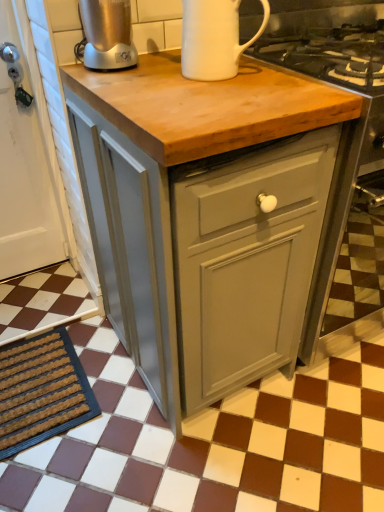
Describe the element at coordinates (214, 38) in the screenshot. This screenshot has height=512, width=384. I see `white ceramic mug at upper center, the first kitchen appliance from the right` at that location.

What do you see at coordinates (214, 443) in the screenshot?
I see `brown checkered tile at center` at bounding box center [214, 443].

In order to click on brown checkered tile at center in this screenshot , I will do `click(214, 443)`.

The width and height of the screenshot is (384, 512). In order to click on matte gray cabinet at center in this screenshot , I will do `click(246, 259)`.

What do you see at coordinates (106, 35) in the screenshot?
I see `brushed metal blender at upper left, which is the 1th kitchen appliance from left to right` at bounding box center [106, 35].

Where is `white ceramic mug at upper center, the 2th kitchen appliance when ordered from left to right`? white ceramic mug at upper center, the 2th kitchen appliance when ordered from left to right is located at coordinates (214, 38).

From a real-world perspective, is brown checkered tile at center positioned above or below brown textured mat at lower left?

brown checkered tile at center is below brown textured mat at lower left.

Could you tell me if brown checkered tile at center is facing brown textured mat at lower left?

No.

Between point (248, 461) and point (70, 346), which one is positioned behind?

Positioned behind is point (70, 346).

From the image's perspective, which is below, brown textured mat at lower left or matte gray cabinet at center?

brown textured mat at lower left, from the image's perspective.

In the image, is brown textured mat at lower left positioned in front of or behind matte gray cabinet at center?

brown textured mat at lower left is behind matte gray cabinet at center.

Image resolution: width=384 pixels, height=512 pixels. Find the location of `doormat behind the matte gray cabinet at center`. doormat behind the matte gray cabinet at center is located at coordinates (41, 391).

Does point (25, 400) come in front of point (174, 179)?

No.

Which is behind, white ceramic mug at upper center, the 2th kitchen appliance when ordered from left to right, or brown checkered tile at center?

white ceramic mug at upper center, the 2th kitchen appliance when ordered from left to right, is more distant.

Which is more to the right, white ceramic mug at upper center, the 2th kitchen appliance when ordered from left to right, or brown checkered tile at center?

From the viewer's perspective, brown checkered tile at center appears more on the right side.

Is matte gray cabinet at center positioned far away from brushed metal blender at upper left, the second kitchen appliance from the right?

matte gray cabinet at center is near brushed metal blender at upper left, the second kitchen appliance from the right, not far away.

From a real-world perspective, starting from the matte gray cabinet at center, which kitchen appliance is the 2nd one vertically above it? Please provide its 2D coordinates.

[(106, 35)]

Which is behind, point (277, 258) or point (99, 46)?

The point (277, 258) is more distant.

Which object is closer to the camera, matte gray cabinet at center or brushed metal blender at upper left, which is the 1th kitchen appliance from left to right?

matte gray cabinet at center.

From a real-world perspective, between matte gray cabinet at center and matte gray cabinet at center, who is vertically higher?

matte gray cabinet at center.

Which object is wider, matte gray cabinet at center or matte gray cabinet at center?

With larger width is matte gray cabinet at center.

Which is nearer, (267,228) or (116,230)?

Point (267,228).

Considering the relative positions of matte gray cabinet at center and matte gray cabinet at center in the image provided, is matte gray cabinet at center to the left of matte gray cabinet at center from the viewer's perspective?

In fact, matte gray cabinet at center is to the right of matte gray cabinet at center.

From the image's perspective, which object appears higher, brushed metal blender at upper left, the second kitchen appliance from the right, or matte gray cabinet at center?

brushed metal blender at upper left, the second kitchen appliance from the right, appears higher in the image.

Looking at the image, does brushed metal blender at upper left, the second kitchen appliance from the right, seem bigger or smaller compared to matte gray cabinet at center?

brushed metal blender at upper left, the second kitchen appliance from the right, is smaller than matte gray cabinet at center.

The height and width of the screenshot is (512, 384). I want to click on the 2nd kitchen appliance above when counting from the matte gray cabinet at center (from the image's perspective), so [106, 35].

Who is smaller, matte gray cabinet at center or brown checkered tile at center?

Smaller between the two is brown checkered tile at center.

Does point (168, 335) lie behind point (311, 466)?

No, (168, 335) is closer to viewer.

In terms of height, does matte gray cabinet at center look taller or shorter compared to brown checkered tile at center?

Clearly, matte gray cabinet at center is taller compared to brown checkered tile at center.

Are matte gray cabinet at center and brown checkered tile at center located far from each other?

No, there isn't a large distance between matte gray cabinet at center and brown checkered tile at center.

Find the location of a particular element. This screenshot has height=512, width=384. tile above the brown textured mat at lower left (from the image's perspective) is located at coordinates (214, 443).

Find the location of a particular element. This screenshot has width=384, height=512. doormat below the matte gray cabinet at center (from a real-world perspective) is located at coordinates (41, 391).

Estimate the real-world distances between objects in this image. Which object is closer to matte gray cabinet at center, white ceramic mug at upper center, the 2th kitchen appliance when ordered from left to right, or brushed metal blender at upper left, which is the 1th kitchen appliance from left to right?

white ceramic mug at upper center, the 2th kitchen appliance when ordered from left to right, is positioned closer to the anchor matte gray cabinet at center.

Based on their spatial positions, is brushed metal blender at upper left, the second kitchen appliance from the right, or matte gray cabinet at center closer to brown textured mat at lower left?

Among the two, matte gray cabinet at center is located nearer to brown textured mat at lower left.

From the image, which object appears to be nearer to matte gray cabinet at center, brown textured mat at lower left or brown checkered tile at center?

brown checkered tile at center is closer to matte gray cabinet at center.

Estimate the real-world distances between objects in this image. Which object is further from brushed metal blender at upper left, which is the 1th kitchen appliance from left to right, matte gray cabinet at center or brown checkered tile at center?

Based on the image, brown checkered tile at center appears to be further to brushed metal blender at upper left, which is the 1th kitchen appliance from left to right.

Looking at the image, which one is located closer to brown textured mat at lower left, matte gray cabinet at center or brown checkered tile at center?

brown checkered tile at center is closer to brown textured mat at lower left.

Based on their spatial positions, is brown textured mat at lower left or white ceramic mug at upper center, the first kitchen appliance from the right, closer to brushed metal blender at upper left, which is the 1th kitchen appliance from left to right?

white ceramic mug at upper center, the first kitchen appliance from the right, lies closer to brushed metal blender at upper left, which is the 1th kitchen appliance from left to right, than the other object.

From the picture: Which object lies nearer to the anchor point brown checkered tile at center, matte gray cabinet at center or matte gray cabinet at center?

matte gray cabinet at center.

When comparing their distances from matte gray cabinet at center, does brown checkered tile at center or brushed metal blender at upper left, which is the 1th kitchen appliance from left to right, seem further?

brown checkered tile at center is positioned further to the anchor matte gray cabinet at center.

Where is `table that lies between white ceramic mug at upper center, the 2th kitchen appliance when ordered from left to right, and brown textured mat at lower left from top to bottom`? Image resolution: width=384 pixels, height=512 pixels. table that lies between white ceramic mug at upper center, the 2th kitchen appliance when ordered from left to right, and brown textured mat at lower left from top to bottom is located at coordinates (206, 217).

Identify the location of table between brushed metal blender at upper left, which is the 1th kitchen appliance from left to right, and brown textured mat at lower left in the up-down direction. (206, 217).

Image resolution: width=384 pixels, height=512 pixels. In order to click on kitchen appliance located between brushed metal blender at upper left, the second kitchen appliance from the right, and matte gray cabinet at center in the left-right direction in this screenshot , I will do `click(214, 38)`.

You are a GUI agent. You are given a task and a screenshot of the screen. Output one action in this format:
    pyautogui.click(x=<x>, y=<y>)
    Task: Click on the kitchen appliance that lies between brushed metal blender at upper left, the second kitchen appliance from the right, and brown checkered tile at center from top to bottom
    
    Given the screenshot: What is the action you would take?
    pyautogui.click(x=214, y=38)